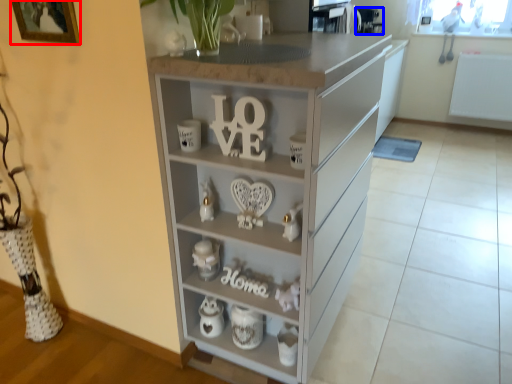
Question: Which object appears closest to the camera in this image, picture frame (highlighted by a red box) or appliance (highlighted by a blue box)?

Choices:
 (A) picture frame
 (B) appliance

Answer: (A)